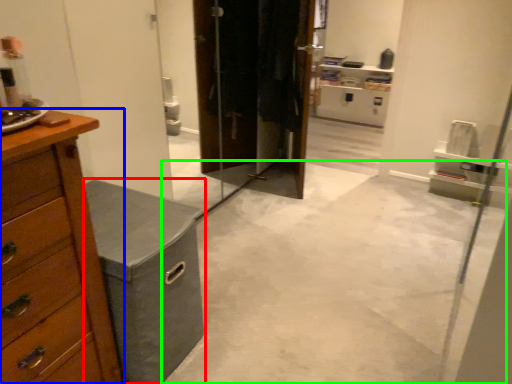
Question: Considering the real-world distances, which object is farthest from vanity (highlighted by a red box)? chest of drawers (highlighted by a blue box) or concrete (highlighted by a green box)?

Choices:
 (A) chest of drawers
 (B) concrete

Answer: (B)